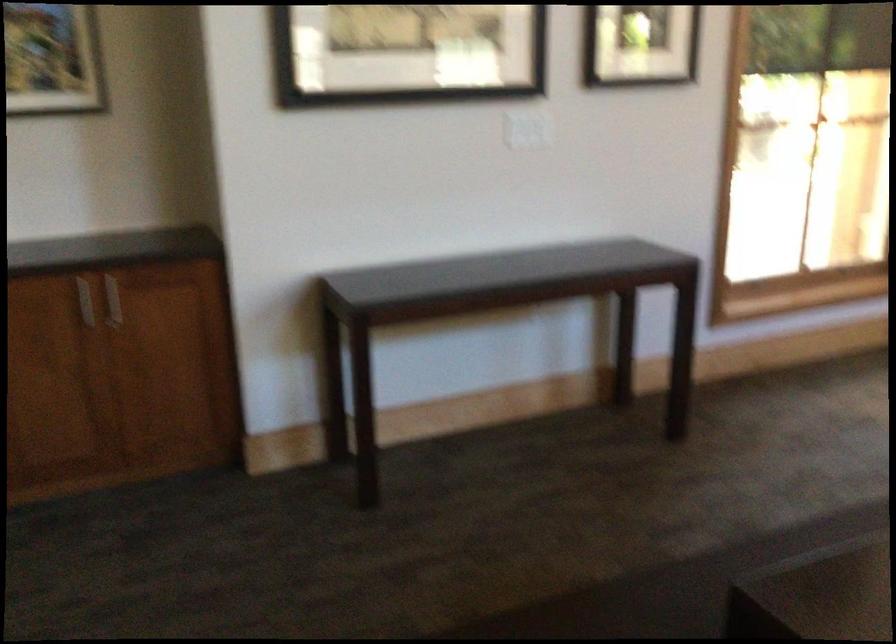
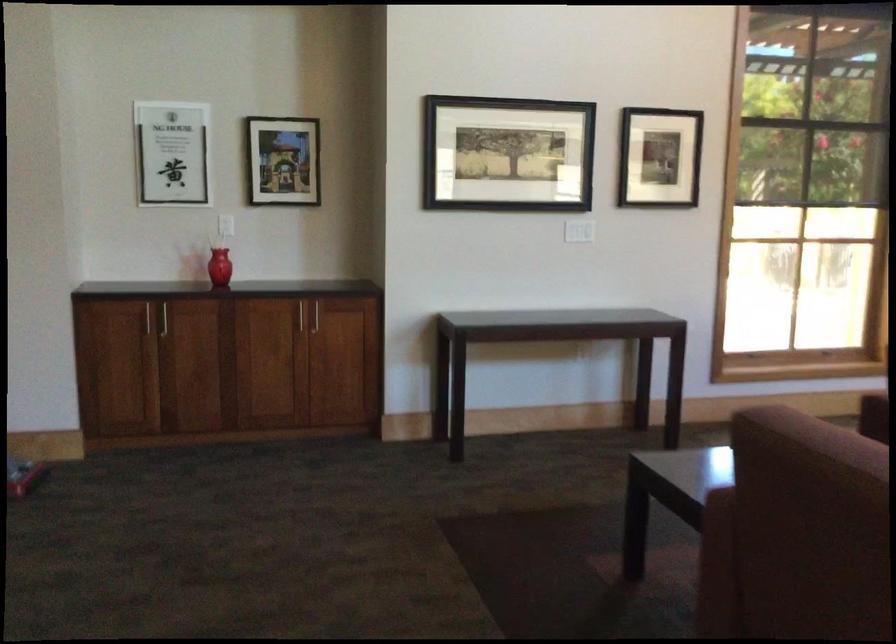
Question: Which direction would the cameraman need to move to produce the second image? Reply with the corresponding letter.

Choices:
 (A) Left
 (B) Right
 (C) Forward
 (D) Backward

Answer: (D)